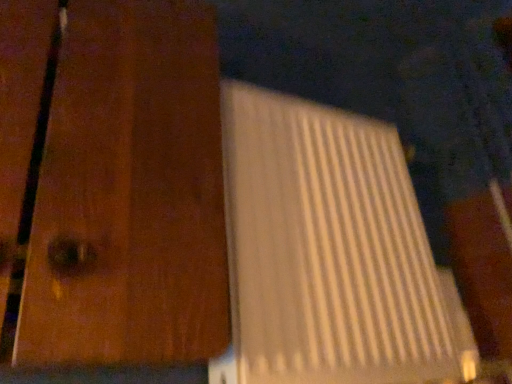
Describe the element at coordinates (330, 253) in the screenshot. I see `white plastic laptop at center` at that location.

Locate an element on the screen. The image size is (512, 384). white plastic laptop at center is located at coordinates (330, 253).

This screenshot has height=384, width=512. What do you see at coordinates (113, 182) in the screenshot?
I see `white matte door at center` at bounding box center [113, 182].

The image size is (512, 384). Find the location of `white matte door at center`. white matte door at center is located at coordinates (113, 182).

You are a GUI agent. You are given a task and a screenshot of the screen. Output one action in this format:
    pyautogui.click(x=<x>, y=<y>)
    Task: Click on the white plastic laptop at center
    
    Given the screenshot: What is the action you would take?
    pyautogui.click(x=330, y=253)

Considering the positions of objects white matte door at center and white plastic laptop at center in the image provided, who is more to the left, white matte door at center or white plastic laptop at center?

white matte door at center.

Between white matte door at center and white plastic laptop at center, which one is positioned in front?

white matte door at center.

Between point (135, 332) and point (379, 155), which one is positioned in front?

The point (135, 332) is closer.

From the image's perspective, which object appears higher, white matte door at center or white plastic laptop at center?

white matte door at center is shown above in the image.

From a real-world perspective, is white matte door at center physically located above or below white plastic laptop at center?

white matte door at center is situated higher than white plastic laptop at center in the real world.

Considering the sizes of objects white matte door at center and white plastic laptop at center in the image provided, who is thinner, white matte door at center or white plastic laptop at center?

white plastic laptop at center.

Between white matte door at center and white plastic laptop at center, which one has less height?

With less height is white plastic laptop at center.

Between white matte door at center and white plastic laptop at center, which one has smaller size?

Smaller between the two is white plastic laptop at center.

Is white matte door at center located outside white plastic laptop at center?

Yes, white matte door at center is not within white plastic laptop at center.

Is white matte door at center next to white plastic laptop at center?

No, white matte door at center is not touching white plastic laptop at center.

Could you tell me if white matte door at center is facing white plastic laptop at center?

No.

What's the angular difference between white matte door at center and white plastic laptop at center's facing directions?

The angular difference between white matte door at center and white plastic laptop at center is 1.14 degrees.

This screenshot has width=512, height=384. Find the location of `door located on the left of white plastic laptop at center`. door located on the left of white plastic laptop at center is located at coordinates coord(113,182).

Is white plastic laptop at center to the left or to the right of white matte door at center in the image?

In the image, white plastic laptop at center appears on the right side of white matte door at center.

Does white plastic laptop at center come behind white matte door at center?

Yes, it is.

Considering the points (384, 339) and (83, 29), which point is behind, point (384, 339) or point (83, 29)?

The point (384, 339) is more distant.

From the image's perspective, is white plastic laptop at center under white matte door at center?

Indeed, from the image's perspective, white plastic laptop at center is shown beneath white matte door at center.

From a real-world perspective, which is physically above, white plastic laptop at center or white matte door at center?

In real-world perspective, white matte door at center is above.

Does white plastic laptop at center have a lesser width compared to white matte door at center?

Correct, the width of white plastic laptop at center is less than that of white matte door at center.

Between white plastic laptop at center and white matte door at center, which one has more height?

With more height is white matte door at center.

Considering the sizes of objects white plastic laptop at center and white matte door at center in the image provided, who is bigger, white plastic laptop at center or white matte door at center?

white matte door at center is bigger.

Would you say white plastic laptop at center contains white matte door at center?

Definitely not — white matte door at center is not inside white plastic laptop at center.

Is white plastic laptop at center not near white matte door at center?

No, white plastic laptop at center is in close proximity to white matte door at center.

Could you tell me if white plastic laptop at center is facing white matte door at center?

No.

You are a GUI agent. You are given a task and a screenshot of the screen. Output one action in this format:
    pyautogui.click(x=<x>, y=<y>)
    Task: Click on the wide to the right of white matte door at center
    The height and width of the screenshot is (384, 512).
    Given the screenshot: What is the action you would take?
    pyautogui.click(x=330, y=253)

Where is `wide located below the white matte door at center (from the image's perspective)`? Image resolution: width=512 pixels, height=384 pixels. wide located below the white matte door at center (from the image's perspective) is located at coordinates (330, 253).

This screenshot has width=512, height=384. In order to click on door above the white plastic laptop at center (from a real-world perspective) in this screenshot , I will do `click(113, 182)`.